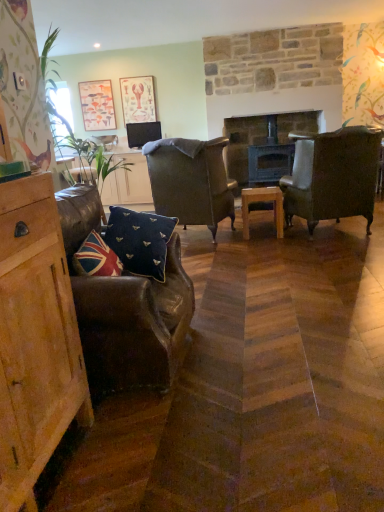
Question: Is leather wingback chair at center, the 1th chair viewed from the back, in front of or behind green leafy plant at left in the image?

Choices:
 (A) behind
 (B) front

Answer: (A)

Question: Is leather wingback chair at center, which is counted as the second chair, starting from the left, wider or thinner than green leafy plant at left?

Choices:
 (A) thin
 (B) wide

Answer: (B)

Question: Which object is positioned closest to the dark wood fireplace at center?

Choices:
 (A) matte black tv at center
 (B) union jack fabric pillow at lower left, the second pillow when ordered from back to front
 (C) navy velvet cushion at center, the second pillow when ordered from front to back
 (D) wooden picture frame at upper left, the second picture frame when ordered from right to left
 (E) leather armchair at center, which ranks as the third chair in left-to-right order

Answer: (A)

Question: Estimate the real-world distances between objects in this image. Which object is closer to the leather armchair at left, acting as the third chair starting from the back?

Choices:
 (A) matte paper picture frame at upper center, the second picture frame positioned from the left
 (B) wooden table at center
 (C) leather armchair at center, which appears as the 2th chair when viewed from the front
 (D) green leafy plant at left
 (E) navy velvet cushion at center, which is counted as the 1th pillow, starting from the back

Answer: (E)